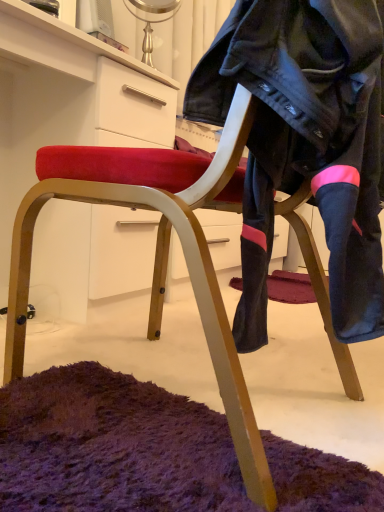
Question: Is velvet red chair at lower left positioned with its back to black leather jacket at center?

Choices:
 (A) yes
 (B) no

Answer: (B)

Question: Is velvet red chair at lower left to the right of black leather jacket at center from the viewer's perspective?

Choices:
 (A) yes
 (B) no

Answer: (B)

Question: From the image's perspective, would you say velvet red chair at lower left is positioned over black leather jacket at center?

Choices:
 (A) yes
 (B) no

Answer: (A)

Question: Would you say velvet red chair at lower left contains black leather jacket at center?

Choices:
 (A) yes
 (B) no

Answer: (B)

Question: Is velvet red chair at lower left positioned behind black leather jacket at center?

Choices:
 (A) yes
 (B) no

Answer: (A)

Question: Can you confirm if velvet red chair at lower left is smaller than black leather jacket at center?

Choices:
 (A) yes
 (B) no

Answer: (B)

Question: Is the surface of black leather jacket at center in direct contact with velvet red chair at lower left?

Choices:
 (A) yes
 (B) no

Answer: (B)

Question: Can you confirm if black leather jacket at center is positioned to the left of velvet red chair at lower left?

Choices:
 (A) yes
 (B) no

Answer: (B)

Question: Can you confirm if black leather jacket at center is wider than velvet red chair at lower left?

Choices:
 (A) no
 (B) yes

Answer: (A)

Question: From a real-world perspective, is black leather jacket at center on velvet red chair at lower left?

Choices:
 (A) yes
 (B) no

Answer: (A)

Question: Considering the relative positions of black leather jacket at center and velvet red chair at lower left in the image provided, is black leather jacket at center to the right of velvet red chair at lower left from the viewer's perspective?

Choices:
 (A) yes
 (B) no

Answer: (A)

Question: Is black leather jacket at center surrounding velvet red chair at lower left?

Choices:
 (A) yes
 (B) no

Answer: (B)

Question: Is velvet red chair at lower left taller or shorter than black leather jacket at center?

Choices:
 (A) tall
 (B) short

Answer: (A)